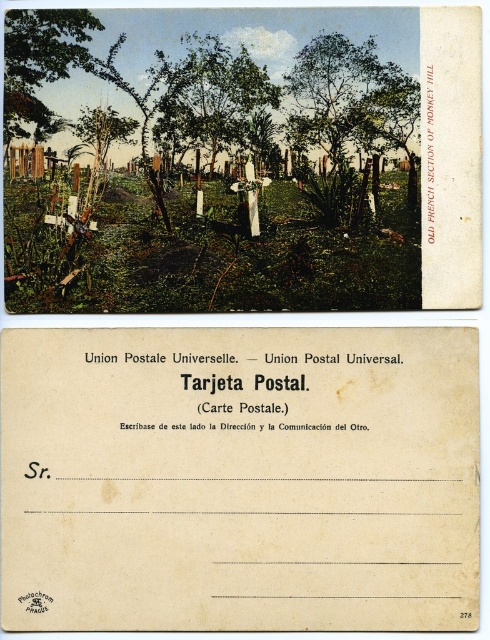
You are looking at the vintage postcard of the cemetery. There are two green leafy trees visible in the top half of the image. Which tree, the green leafy tree at upper center or the green leafy tree at center, appears larger in the photograph?

The green leafy tree at upper center appears larger than the green leafy tree at center in the photograph.

Based on the vintage postcard scene, which tree has a greater width between the green leafy tree at upper center and the green leafy tree at center?

The green leafy tree at upper center has a greater width than the green leafy tree at center.

Looking at the vintage postcard, there are two green leafy trees in the top half. Which tree, the green leafy tree at upper center or the green leafy tree at upper left, is positioned to the right of the other?

The green leafy tree at upper center is positioned to the right of the green leafy tree at upper left.